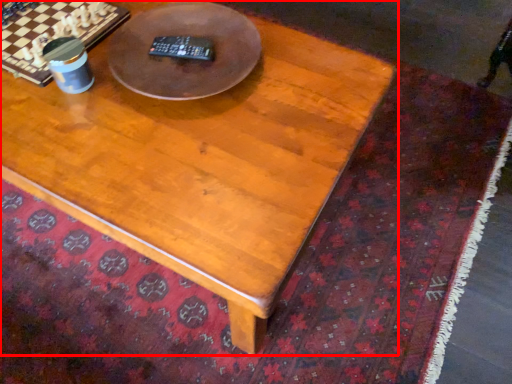
Question: In this image, where is coffee table (annotated by the red box) located relative to round table?

Choices:
 (A) left
 (B) right

Answer: (A)